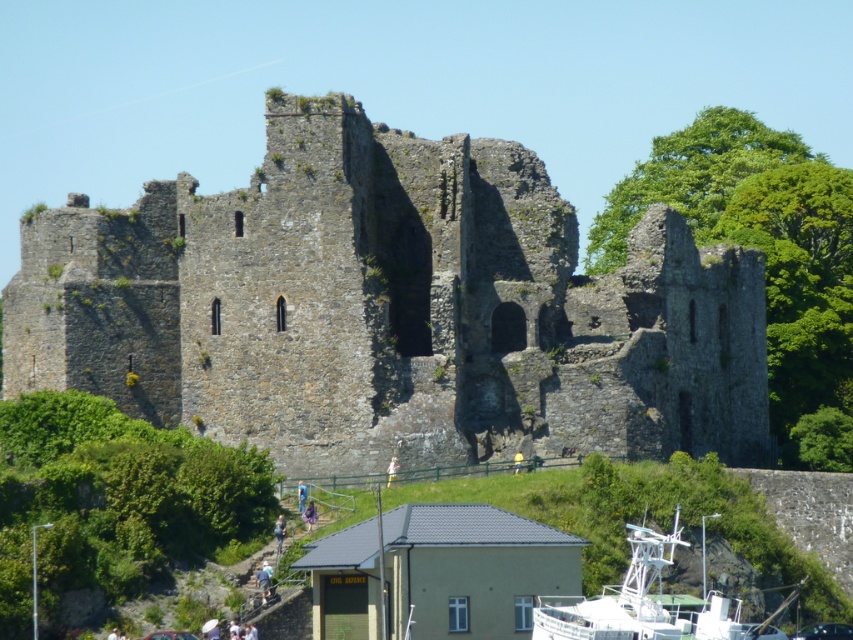
You are standing at the bottom of the staircase leading up to the castle ruins. You see a point marked at coordinates (390, 308). What does this point indicate?

The point at coordinates (390, 308) indicates the location of the rusty stone castle at center.

In the scene shown: You are standing at the base of the hill where the historic stone castle ruin is located. You want to reach a specific point marked at coordinates point (734, 352). Given that the distance from your current position to this point is 117.11 meters, can you estimate how far you need to walk to reach it?

The distance to point (734, 352) is 117.11 meters, so you need to walk approximately 117.11 meters to reach it.

You are a visitor at the castle ruin and want to take a photo of both the rusty stone castle at center and the white plastic boat at lower center. Which object should you focus on first if you want to include both in the frame without moving your camera?

You should focus on the rusty stone castle at center first because it is much taller than the white plastic boat at lower center, so you need to ensure it fits within the frame while still capturing the boat.